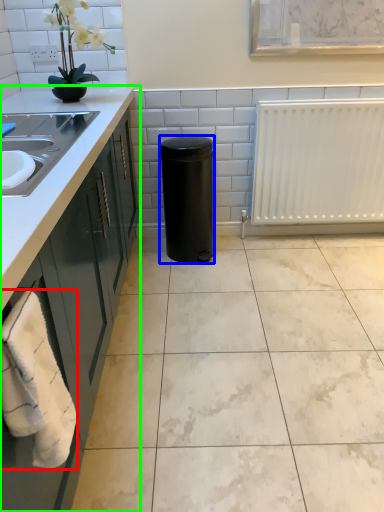
Question: Which object is the farthest from bath towel (highlighted by a red box)? Choose among these: appliance (highlighted by a blue box) or countertop (highlighted by a green box).

Choices:
 (A) appliance
 (B) countertop

Answer: (A)